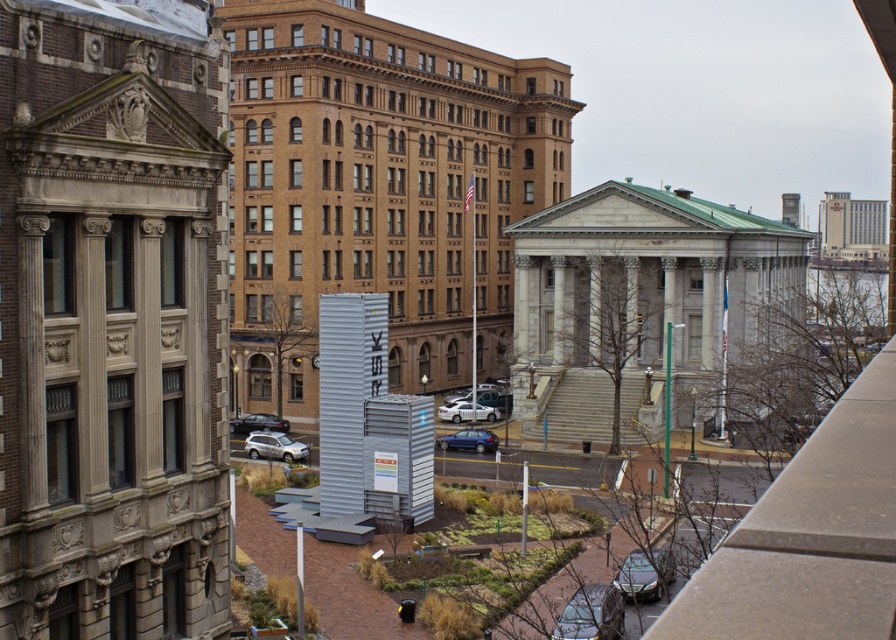
You are a delivery driver who needs to park your vehicle in this city area. You have two options for parking spots available near the white matte car at center and the shiny black car at lower left. Considering the height restrictions in the area, which parking spot would be safer to choose if your delivery van is 2 meters tall?

The white matte car at center has a lesser height compared to the shiny black car at lower left. Since your delivery van is 2 meters tall, the parking spot near the white matte car at center would be safer as it likely has lower height restrictions, matching the car height.

From the picture: You are standing in the cityscape and want to take a photo of the point at coordinates point (616, 580). If your camera has a maximum focus range of 40 meters, will it be able to focus on the point?

The distance of point (616, 580) from camera is 39.99 meters, so yes, the camera can focus on the point since it is within the 40 meters range.